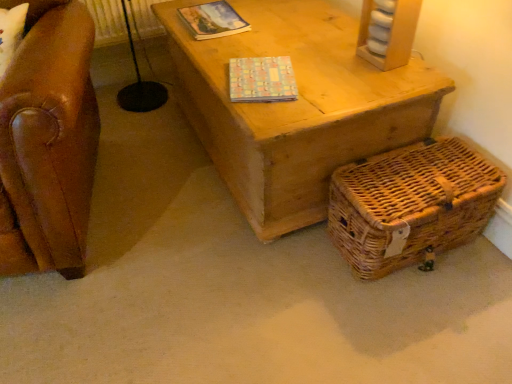
This screenshot has width=512, height=384. I want to click on blank space above multicolored paper book at upper center, the second magazine in the front-to-back sequence (from a real-world perspective), so click(212, 21).